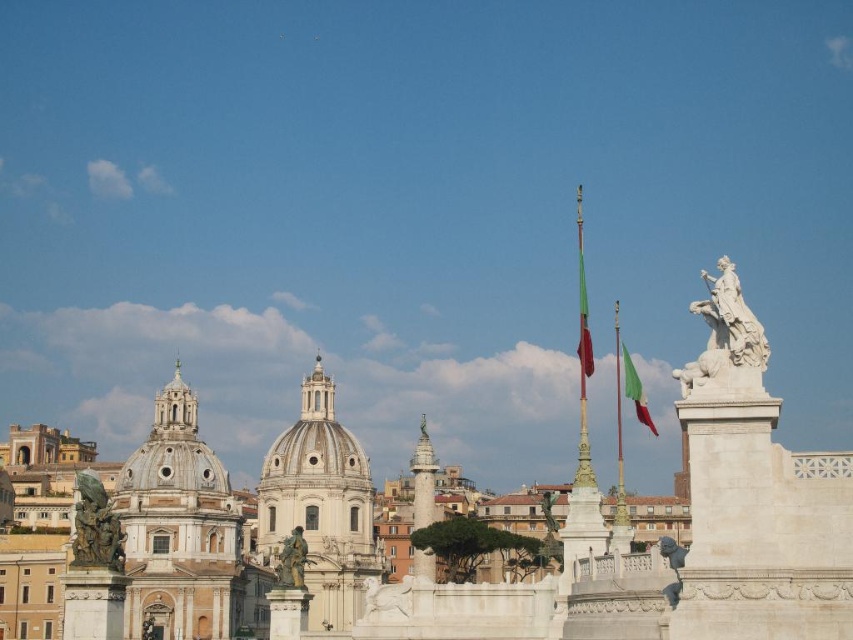
You are standing in the historic cityscape and want to take a photo of the bronze statue at left. Given that the statue is at coordinates 0.825, 0.113, which direction should you face to ensure it is centered in your camera view?

The bronze statue at left is located at point (96, 528), so you should face towards the left side of the scene to center it in your camera view.

You are a tourist standing in front of the historic cityscape. You notice the white marble statue at center and the green fabric flag at center. Which object is positioned higher in the scene?

The green fabric flag at center is higher because the white marble statue at center is below it.